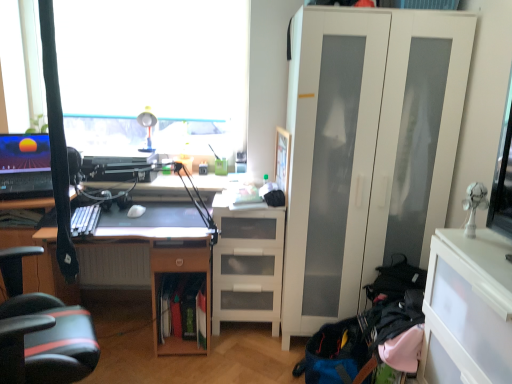
Question: Is white matte mouse at center bigger or smaller than wooden desk at center?

Choices:
 (A) small
 (B) big

Answer: (A)

Question: From the image's perspective, is white matte mouse at center located above or below wooden desk at center?

Choices:
 (A) below
 (B) above

Answer: (B)

Question: Considering the real-world distances, which object is farthest from the white matte cabinet at right?

Choices:
 (A) white matte mouse at center
 (B) wooden desk at center
 (C) matte plastic table lamp at upper center
 (D) white matte drawer at center
 (E) transparent glass window at upper left

Answer: (C)

Question: Considering the real-world distances, which object is closest to the matte plastic table lamp at upper center?

Choices:
 (A) white matte cabinet at right
 (B) transparent glass window at upper left
 (C) transparent plastic cabinet at lower right
 (D) white matte drawer at center
 (E) wooden desk at center

Answer: (B)